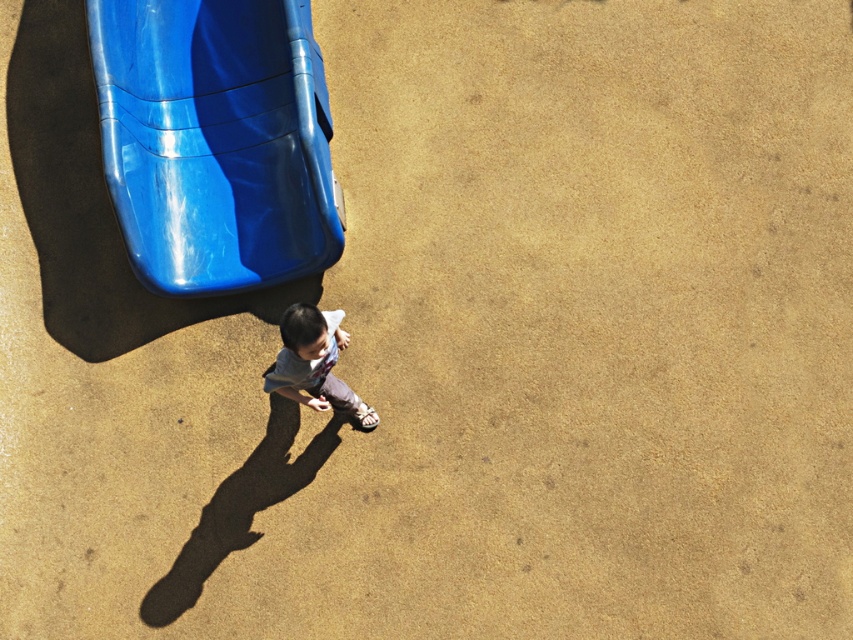
Which is more to the left, glossy plastic slide at upper left or light gray cotton shirt at center?

Positioned to the left is glossy plastic slide at upper left.

Is glossy plastic slide at upper left to the right of light gray cotton shirt at center from the viewer's perspective?

No, glossy plastic slide at upper left is not to the right of light gray cotton shirt at center.

Find the location of a particular element. glossy plastic slide at upper left is located at coordinates (213, 140).